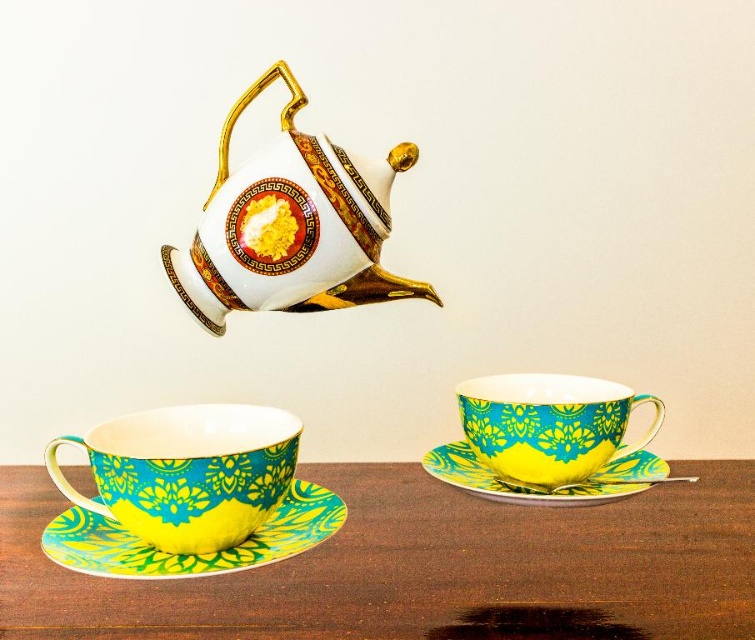
Based on the photo, you are holding a small object that needs to be placed exactly at the point marked by coordinates point (217, 214). Given that the point is 27.65 inches away from you, can you confirm if placing it there is feasible without moving closer?

The point (217, 214) is 27.65 inches away from the viewer, so placing the object there is feasible without needing to move closer as the distance is within reach.

You are a photographer holding a camera and want to capture a closeup of the turquoise glossy teacup at lower left. Given that you are currently 17.48 inches away from the teacup, is this distance suitable for a detailed closeup shot?

The distance between you and the turquoise glossy teacup at lower left is exactly 17.48 inches, which is suitable for a detailed closeup shot as it allows for clear focus and captures the intricate details of the teacup without being too close to cause blurring.

You are looking at the image of teacups and a teapot on a wooden table. There are two points marked in the image. The first point is at coordinates point (106, 488) and the second point is at point (632, 470). Which of these two points is closer to you?

Point (106, 488) is closer to the viewer than point (632, 470).